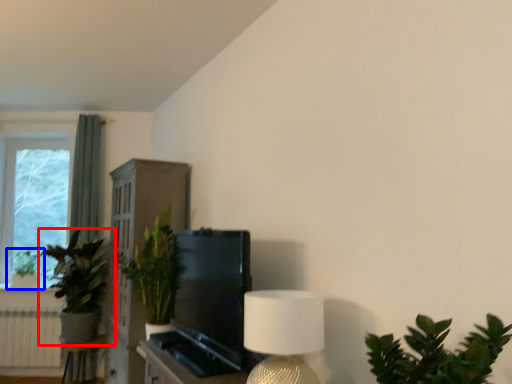
Question: Which object is further to the camera taking this photo, houseplant (highlighted by a red box) or houseplant (highlighted by a blue box)?

Choices:
 (A) houseplant
 (B) houseplant

Answer: (B)